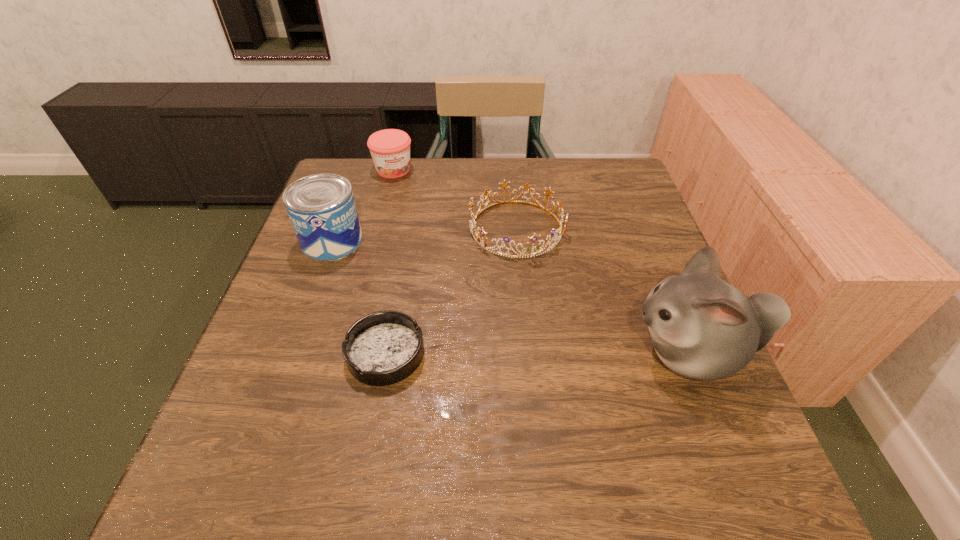
The width and height of the screenshot is (960, 540). In order to click on vacant area situated on the front label of the farthest object in this screenshot , I will do `click(422, 220)`.

This screenshot has width=960, height=540. In order to click on tiara located in the far edge section of the desktop in this screenshot , I will do `click(472, 222)`.

What are the coordinates of `jam situated at the far edge` in the screenshot? It's located at (390, 149).

The width and height of the screenshot is (960, 540). I want to click on object at the near edge, so click(x=701, y=327).

You are a GUI agent. You are given a task and a screenshot of the screen. Output one action in this format:
    pyautogui.click(x=<x>, y=<y>)
    Task: Click on the can that is positioned at the left edge
    
    Given the screenshot: What is the action you would take?
    pyautogui.click(x=321, y=207)

You are a GUI agent. You are given a task and a screenshot of the screen. Output one action in this format:
    pyautogui.click(x=<x>, y=<y>)
    Task: Click on the jam at the left edge
    
    Given the screenshot: What is the action you would take?
    [390, 149]

In order to click on object that is at the right edge in this screenshot , I will do `click(701, 327)`.

Find the location of `object located at the far left corner`. object located at the far left corner is located at coordinates coord(390,149).

This screenshot has height=540, width=960. I want to click on object at the near right corner, so point(701,327).

This screenshot has height=540, width=960. Identify the location of vacant space at the far edge of the desktop. (526, 173).